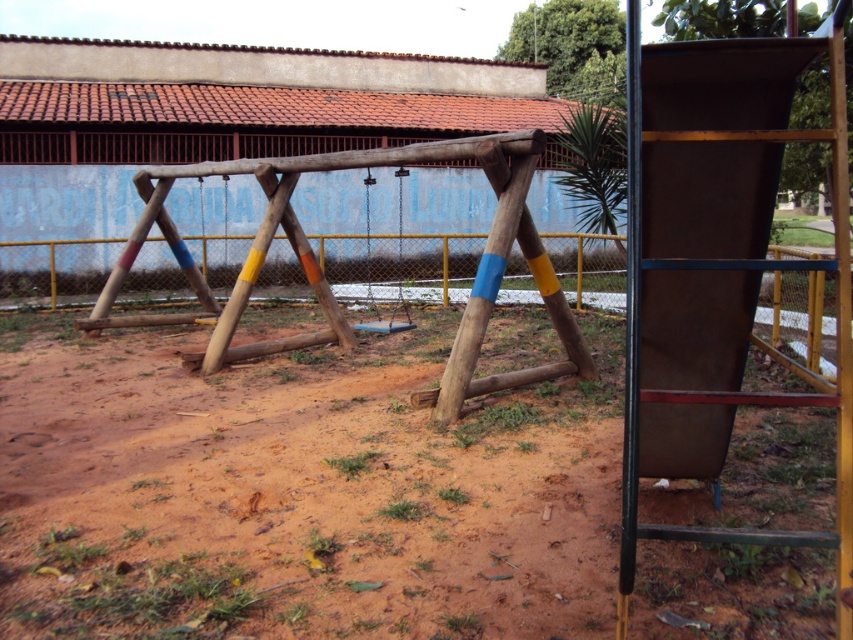
You are standing at the edge of the playground and want to reach the brown dirt field at center. Which direction should you move in to get there?

The brown dirt field at center is located at point coordinates of (299, 492), so you should move towards the center of the playground to reach it.

Consider the image. You are a child trying to climb the brown matte ladder at right to reach the swing set. Can you step onto the brown dirt field at center from the ladder?

The brown dirt field at center is positioned under the brown matte ladder at right, so yes, you can step onto the brown dirt field at center from the ladder.